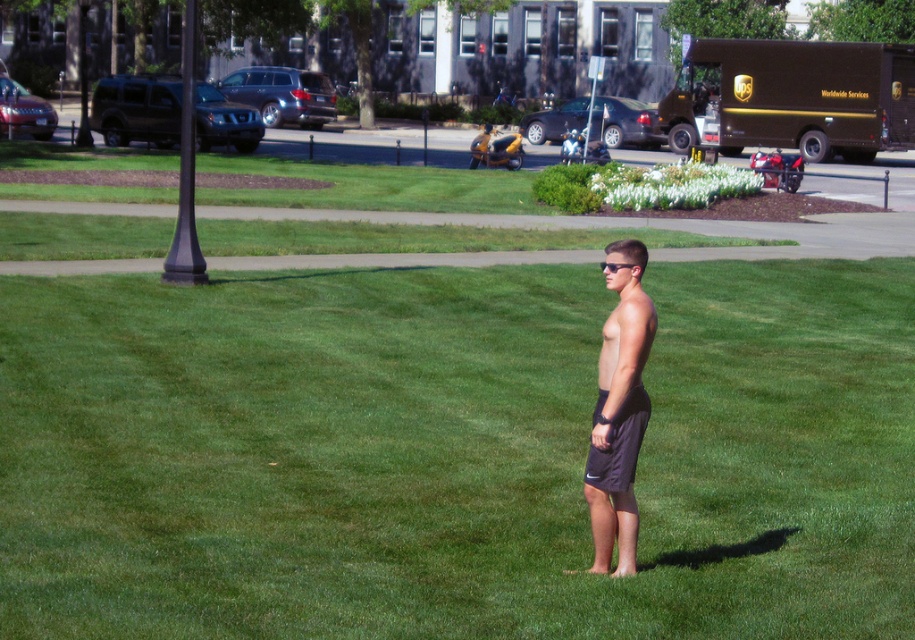
Question: Where is dark gray shorts at center located in relation to black fabric shorts at center in the image?

Choices:
 (A) above
 (B) below

Answer: (A)

Question: Does dark gray shorts at center come behind black fabric shorts at center?

Choices:
 (A) yes
 (B) no

Answer: (B)

Question: Which point is farther to the camera?

Choices:
 (A) black fabric shorts at center
 (B) dark gray shorts at center

Answer: (A)

Question: Which object appears farthest from the camera in this image?

Choices:
 (A) dark gray shorts at center
 (B) black fabric shorts at center

Answer: (B)

Question: Observing the image, what is the correct spatial positioning of dark gray shorts at center in reference to black fabric shorts at center?

Choices:
 (A) above
 (B) below

Answer: (A)